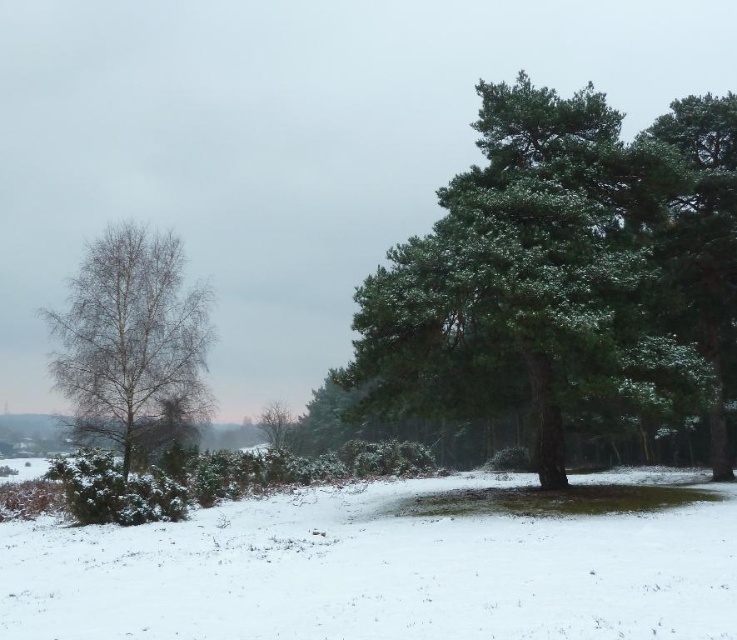
How far apart are green textured tree at center and white fluffy snow at center?

green textured tree at center is 6.35 meters from white fluffy snow at center.

What do you see at coordinates (565, 269) in the screenshot?
I see `green textured tree at center` at bounding box center [565, 269].

Does point (422, 308) lie behind point (719, 612)?

Yes, it is behind point (719, 612).

You are a GUI agent. You are given a task and a screenshot of the screen. Output one action in this format:
    pyautogui.click(x=<x>, y=<y>)
    Task: Click on the green textured tree at center
    
    Given the screenshot: What is the action you would take?
    pyautogui.click(x=565, y=269)

How much distance is there between green textured tree at center and green textured tree at right?

green textured tree at center and green textured tree at right are 1.76 meters apart.

Who is higher up, green textured tree at center or green textured tree at right?

green textured tree at center

Does point (722, 156) come closer to viewer compared to point (716, 218)?

No, it is not.

Image resolution: width=737 pixels, height=640 pixels. Find the location of `green textured tree at center`. green textured tree at center is located at coordinates (565, 269).

The image size is (737, 640). What are the coordinates of `green textured tree at center` in the screenshot? It's located at (565, 269).

Does point (548, 186) lie behind point (94, 406)?

No, (548, 186) is in front of (94, 406).

The image size is (737, 640). I want to click on green textured tree at center, so click(565, 269).